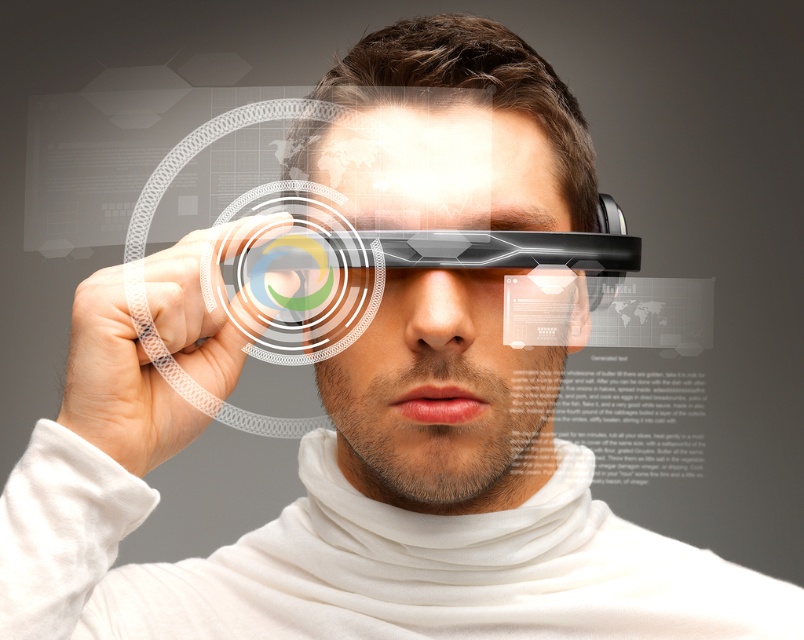
Question: Among these objects, which one is nearest to the camera?

Choices:
 (A) translucent plastic hand at center
 (B) transparent plastic face at center

Answer: (A)

Question: From the image, what is the correct spatial relationship of transparent plastic face at center in relation to translucent plastic hand at center?

Choices:
 (A) above
 (B) below

Answer: (A)

Question: Is transparent plastic face at center positioned at the back of translucent plastic hand at center?

Choices:
 (A) yes
 (B) no

Answer: (A)

Question: Which point appears farthest from the camera in this image?

Choices:
 (A) (442, 305)
 (B) (129, 413)

Answer: (A)

Question: Can you confirm if transparent plastic face at center is positioned to the left of translucent plastic hand at center?

Choices:
 (A) no
 (B) yes

Answer: (A)

Question: Which object appears farthest from the camera in this image?

Choices:
 (A) translucent plastic hand at center
 (B) transparent plastic face at center

Answer: (B)